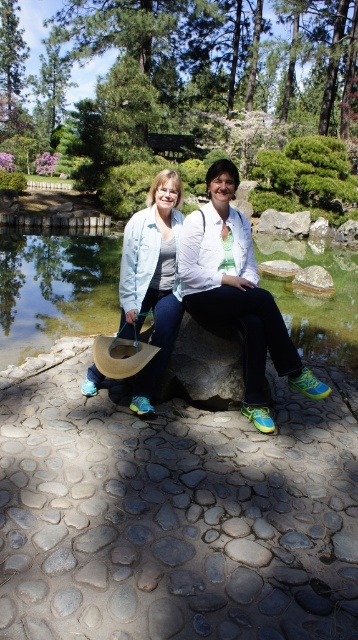
Question: Is transparent glass lake at center wider than light blue denim jacket at center?

Choices:
 (A) no
 (B) yes

Answer: (B)

Question: Among these objects, which one is farthest from the camera?

Choices:
 (A) transparent glass lake at center
 (B) matte white jacket at center
 (C) light blue denim jacket at center

Answer: (A)

Question: Can you confirm if transparent glass lake at center is positioned below matte white jacket at center?

Choices:
 (A) yes
 (B) no

Answer: (B)

Question: Which object is closer to the camera taking this photo?

Choices:
 (A) matte white jacket at center
 (B) transparent glass lake at center
 (C) light blue denim jacket at center

Answer: (A)

Question: Is matte white jacket at center wider than light blue denim jacket at center?

Choices:
 (A) yes
 (B) no

Answer: (A)

Question: Among these points, which one is nearest to the camera?

Choices:
 (A) (252, 246)
 (B) (121, 262)

Answer: (A)